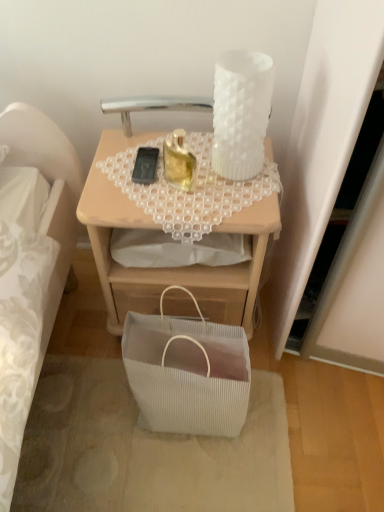
Question: In terms of width, does translucent glass candle at upper center, arranged as the second candle holder when viewed from the right, look wider or thinner when compared to black matte mobile phone at center?

Choices:
 (A) wide
 (B) thin

Answer: (B)

Question: Is point (175, 177) positioned closer to the camera than point (139, 177)?

Choices:
 (A) farther
 (B) closer

Answer: (A)

Question: Estimate the real-world distances between objects in this image. Which object is closer to the black matte mobile phone at center?

Choices:
 (A) white frosted glass candle holder at upper right, the 2th candle holder from the left
 (B) translucent glass candle at upper center, arranged as the first candle holder when viewed from the left
 (C) matte wooden desk at center
 (D) white ribbed fabric bag at lower center

Answer: (B)

Question: Estimate the real-world distances between objects in this image. Which object is farther from the white ribbed fabric bag at lower center?

Choices:
 (A) matte wooden desk at center
 (B) white frosted glass candle holder at upper right, the 2th candle holder from the left
 (C) translucent glass candle at upper center, arranged as the second candle holder when viewed from the right
 (D) black matte mobile phone at center

Answer: (B)